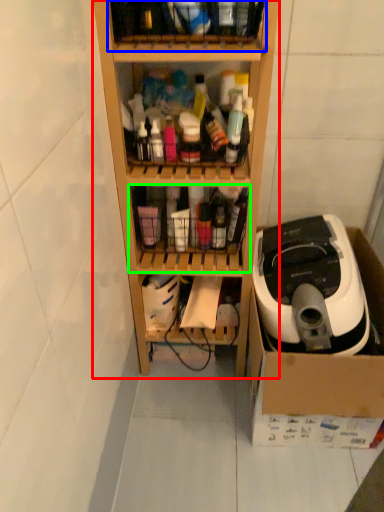
Question: Estimate the real-world distances between objects in this image. Which object is farther from shelf (highlighted by a red box), shelf (highlighted by a blue box) or shelf (highlighted by a green box)?

Choices:
 (A) shelf
 (B) shelf

Answer: (A)